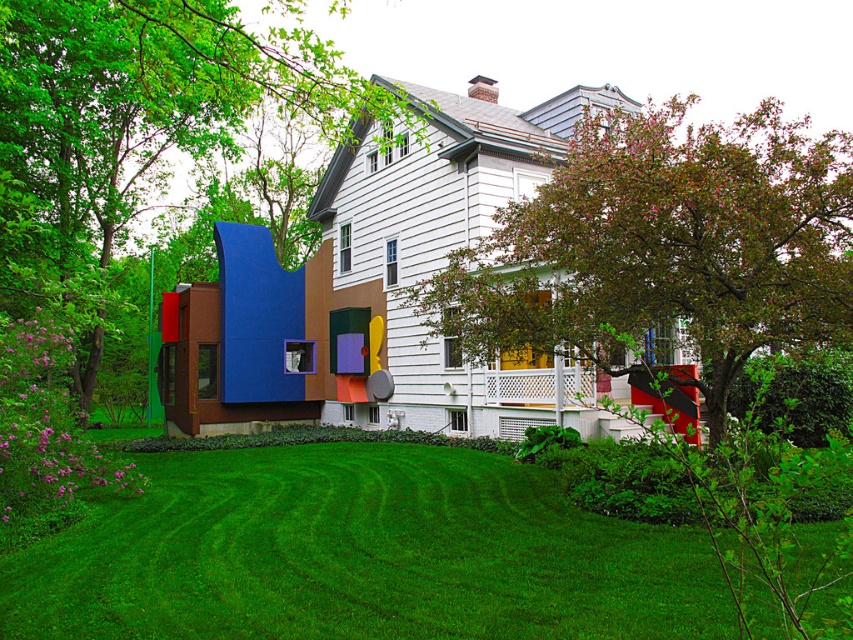
Can you confirm if green grass at lower center is positioned to the left of green leafy tree at left?

In fact, green grass at lower center is to the right of green leafy tree at left.

Which is more to the right, green grass at lower center or green leafy tree at left?

green grass at lower center is more to the right.

Which is in front, point (61, 596) or point (114, 56)?

Point (61, 596) is more forward.

This screenshot has height=640, width=853. Find the location of `green grass at lower center`. green grass at lower center is located at coordinates (358, 554).

In the scene shown: Who is shorter, smooth bark tree at center or green leafy tree at left?

With less height is smooth bark tree at center.

Describe the element at coordinates (663, 248) in the screenshot. The height and width of the screenshot is (640, 853). I see `smooth bark tree at center` at that location.

At what (x,y) coordinates should I click in order to perform the action: click on smooth bark tree at center. Please return your answer as a coordinate pair (x, y). Image resolution: width=853 pixels, height=640 pixels. Looking at the image, I should click on (663, 248).

Where is `smooth bark tree at center`? smooth bark tree at center is located at coordinates (663, 248).

Is green grass at lower center shorter than smooth bark tree at center?

Indeed, green grass at lower center has a lesser height compared to smooth bark tree at center.

Between point (403, 525) and point (799, 180), which one is positioned in front?

Positioned in front is point (799, 180).

Is point (70, 545) closer to camera compared to point (762, 218)?

That is False.

The height and width of the screenshot is (640, 853). In order to click on green grass at lower center in this screenshot , I will do `click(358, 554)`.